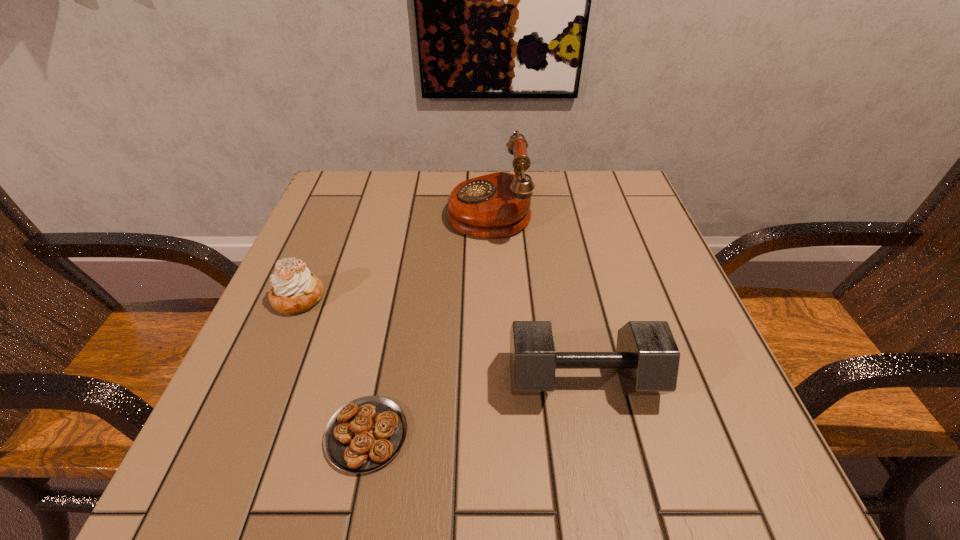
Find the location of a particular element. the farthest object is located at coordinates (497, 205).

This screenshot has width=960, height=540. Find the location of `telephone`. telephone is located at coordinates (497, 205).

Where is `dumbbell`? dumbbell is located at coordinates (647, 358).

Identify the location of the farther pastry. (294, 290).

This screenshot has height=540, width=960. I want to click on the third nearest object, so point(294,290).

Find the location of `the nearer pastry`. the nearer pastry is located at coordinates (365, 434).

Locate an element on the screen. The width and height of the screenshot is (960, 540). the third object from right to left is located at coordinates (365, 434).

The height and width of the screenshot is (540, 960). Find the location of `free spot located 0.220m on the dial of the farthest object`. free spot located 0.220m on the dial of the farthest object is located at coordinates (355, 210).

The height and width of the screenshot is (540, 960). In order to click on blank space located 0.280m on the dial of the farthest object in this screenshot , I will do `click(329, 210)`.

You are a GUI agent. You are given a task and a screenshot of the screen. Output one action in this format:
    pyautogui.click(x=<x>, y=<y>)
    Task: Click on the blank space located 0.150m on the dial of the farthest object
    
    Given the screenshot: What is the action you would take?
    pyautogui.click(x=385, y=210)